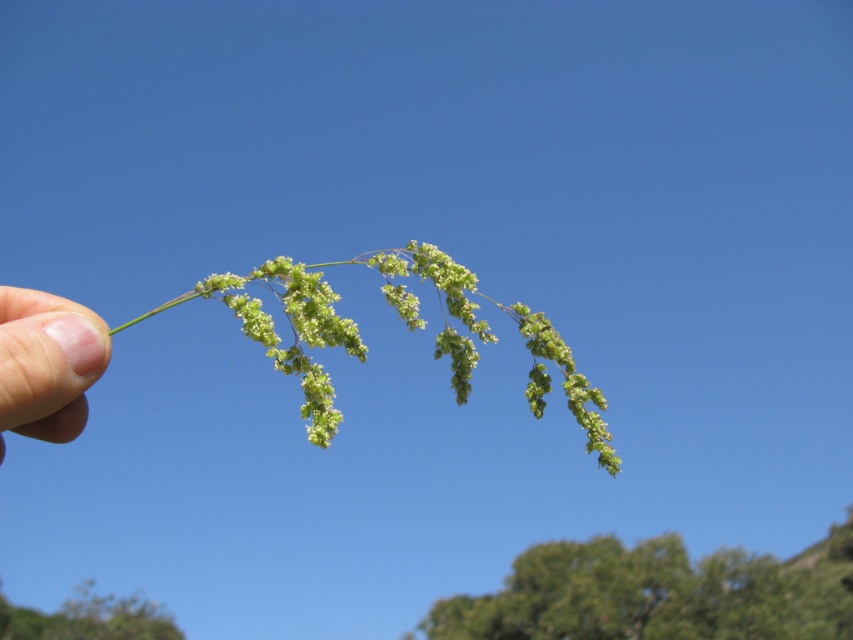
Between green fuzzy plant at center and pink flesh at lower left, which one has less height?

Standing shorter between the two is pink flesh at lower left.

Which is in front, point (294, 346) or point (74, 388)?

Positioned in front is point (74, 388).

Identify the location of green fuzzy plant at center. This screenshot has width=853, height=640. (405, 326).

Measure the distance between green fuzzy plant at center and green fuzzy plant at lower left.

A distance of 41.14 feet exists between green fuzzy plant at center and green fuzzy plant at lower left.

Can you confirm if green fuzzy plant at center is shorter than green fuzzy plant at lower left?

Yes, green fuzzy plant at center is shorter than green fuzzy plant at lower left.

The height and width of the screenshot is (640, 853). In order to click on green fuzzy plant at center in this screenshot , I will do `click(405, 326)`.

Is pink flesh at lower left to the left of green fuzzy plant at lower left from the viewer's perspective?

No, pink flesh at lower left is not to the left of green fuzzy plant at lower left.

Between point (12, 344) and point (68, 618), which one is positioned behind?

The point (68, 618) is more distant.

The width and height of the screenshot is (853, 640). What are the coordinates of `pink flesh at lower left` in the screenshot? It's located at coord(45,364).